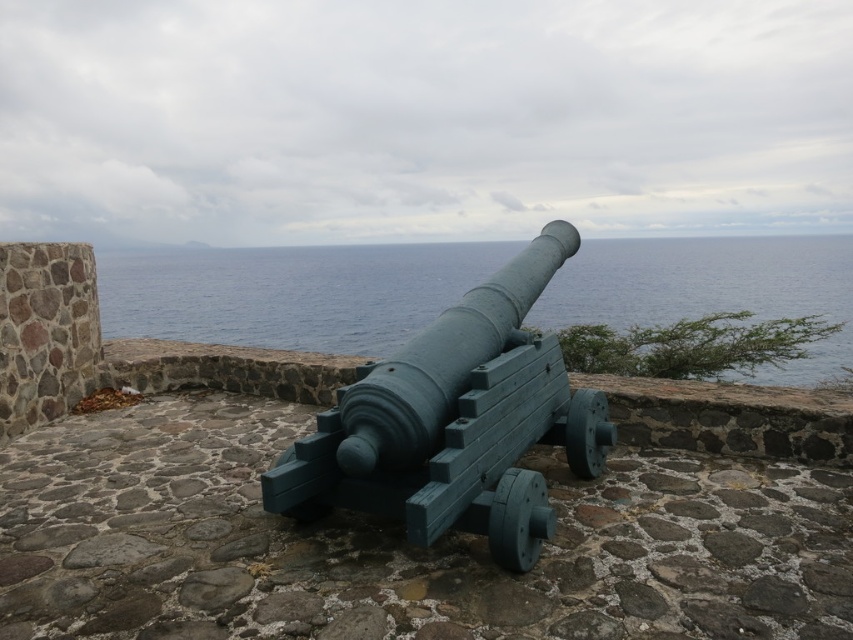
Which of these two, teal painted wood cannon at center or green painted wood at center, stands taller?

Standing taller between the two is teal painted wood cannon at center.

Is point (438, 387) closer to camera compared to point (619, 380)?

Yes, it is in front of point (619, 380).

The height and width of the screenshot is (640, 853). Find the location of `teal painted wood cannon at center`. teal painted wood cannon at center is located at coordinates (456, 422).

Looking at this image, is blue water at center bigger than teal painted wood cannon at center?

Indeed, blue water at center has a larger size compared to teal painted wood cannon at center.

From the picture: Does blue water at center appear over teal painted wood cannon at center?

Indeed, blue water at center is positioned over teal painted wood cannon at center.

Does point (289, 284) lie in front of point (482, 492)?

No, it is not.

This screenshot has width=853, height=640. Find the location of `blue water at center`. blue water at center is located at coordinates (289, 292).

Can you confirm if green painted wood cannon at center is smaller than green painted wood at center?

Correct, green painted wood cannon at center occupies less space than green painted wood at center.

In the scene shown: How much distance is there between green painted wood cannon at center and green painted wood at center?

4.70 meters

Between point (25, 444) and point (126, 355), which one is positioned behind?

The point (126, 355) is behind.

Image resolution: width=853 pixels, height=640 pixels. What are the coordinates of `green painted wood cannon at center` in the screenshot? It's located at (399, 529).